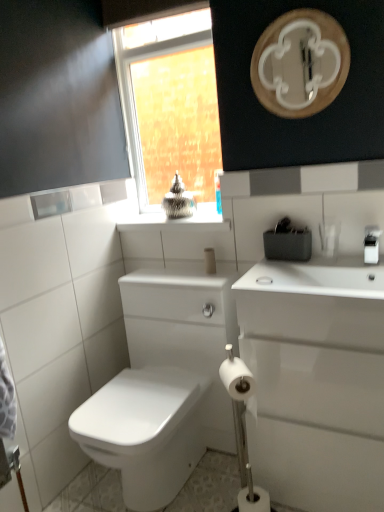
Question: Would you say clear glass window at upper center is part of white matte toilet paper at lower center, arranged as the 2th toilet paper when ordered from the bottom,'s contents?

Choices:
 (A) yes
 (B) no

Answer: (B)

Question: Considering the relative positions of white matte toilet paper at lower center, which is counted as the 1th toilet paper, starting from the top, and clear glass window at upper center in the image provided, is white matte toilet paper at lower center, which is counted as the 1th toilet paper, starting from the top, behind clear glass window at upper center?

Choices:
 (A) no
 (B) yes

Answer: (A)

Question: Is clear glass window at upper center at the back of white matte toilet paper at lower center, arranged as the 2th toilet paper when ordered from the bottom?

Choices:
 (A) yes
 (B) no

Answer: (B)

Question: Is white matte toilet paper at lower center, arranged as the 2th toilet paper when ordered from the bottom, closer to the viewer compared to clear glass window at upper center?

Choices:
 (A) no
 (B) yes

Answer: (B)

Question: From the image's perspective, is white matte toilet paper at lower center, which is counted as the 1th toilet paper, starting from the top, on clear glass window at upper center?

Choices:
 (A) no
 (B) yes

Answer: (A)

Question: Is white glossy sink at right bigger or smaller than white glossy mirror at upper center?

Choices:
 (A) small
 (B) big

Answer: (B)

Question: Is white glossy sink at right wider or thinner than white glossy mirror at upper center?

Choices:
 (A) thin
 (B) wide

Answer: (B)

Question: Relative to white glossy mirror at upper center, is white glossy sink at right in front or behind?

Choices:
 (A) behind
 (B) front

Answer: (B)

Question: Is point (327, 332) positioned closer to the camera than point (259, 52)?

Choices:
 (A) closer
 (B) farther

Answer: (A)

Question: Considering their positions, is white matte toilet paper at lower center, arranged as the 2th toilet paper when ordered from the bottom, located in front of or behind clear glass window at upper center?

Choices:
 (A) front
 (B) behind

Answer: (A)

Question: Considering the positions of white matte toilet paper at lower center, which is counted as the 1th toilet paper, starting from the top, and clear glass window at upper center in the image, is white matte toilet paper at lower center, which is counted as the 1th toilet paper, starting from the top, taller or shorter than clear glass window at upper center?

Choices:
 (A) short
 (B) tall

Answer: (A)

Question: Would you say white matte toilet paper at lower center, arranged as the 2th toilet paper when ordered from the bottom, is to the left or to the right of clear glass window at upper center in the picture?

Choices:
 (A) right
 (B) left

Answer: (A)

Question: Considering the positions of white matte toilet paper at lower center, arranged as the 2th toilet paper when ordered from the bottom, and clear glass window at upper center in the image, is white matte toilet paper at lower center, arranged as the 2th toilet paper when ordered from the bottom, wider or thinner than clear glass window at upper center?

Choices:
 (A) wide
 (B) thin

Answer: (A)

Question: From their relative heights in the image, would you say white matte cylindrical container at center is taller or shorter than white matte toilet paper at lower center, which is the first toilet paper in bottom-to-top order?

Choices:
 (A) tall
 (B) short

Answer: (B)

Question: Do you think white matte cylindrical container at center is within white matte toilet paper at lower center, the 2th toilet paper from the top, or outside of it?

Choices:
 (A) inside
 (B) outside

Answer: (B)